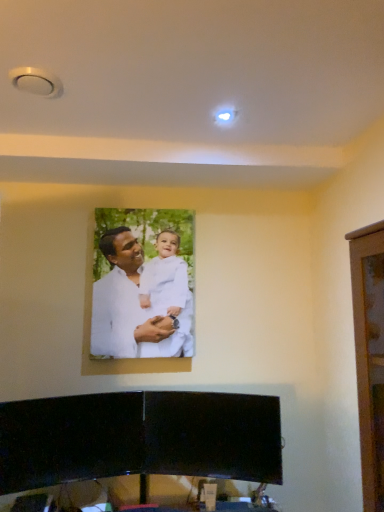
Question: Should I look upward or downward to see white matte portrait at center?

Choices:
 (A) down
 (B) up

Answer: (A)